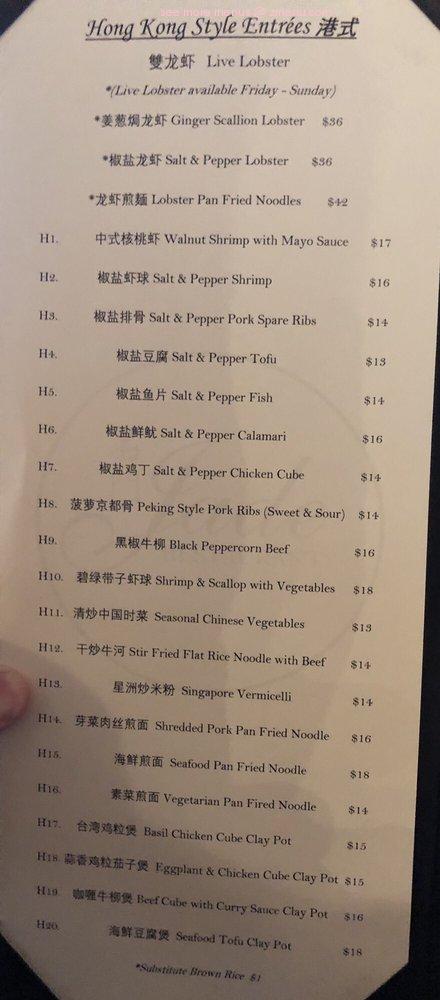
Locate an element on the screen. This screenshot has width=440, height=1000. clay pot dish is located at coordinates (269, 833), (290, 875), (284, 914), (264, 946).